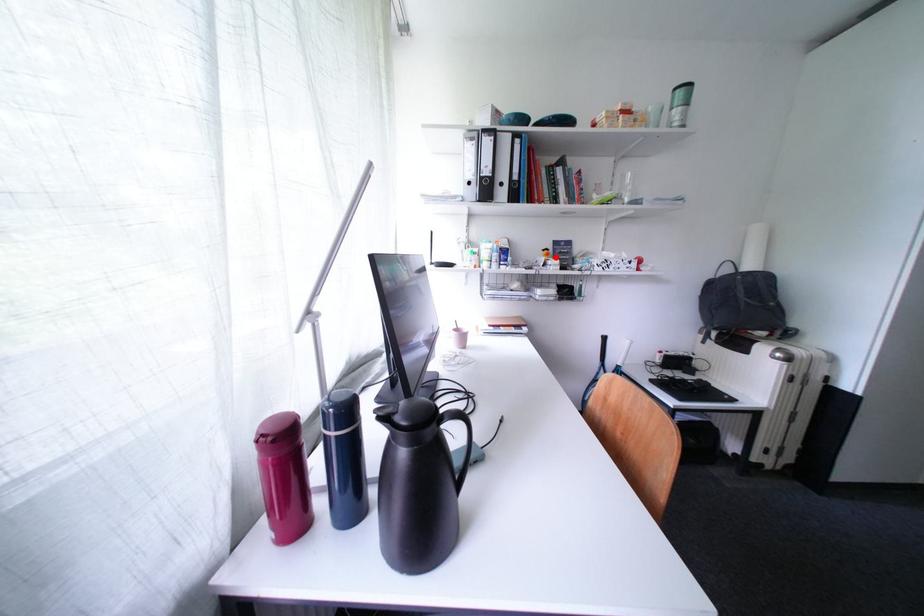
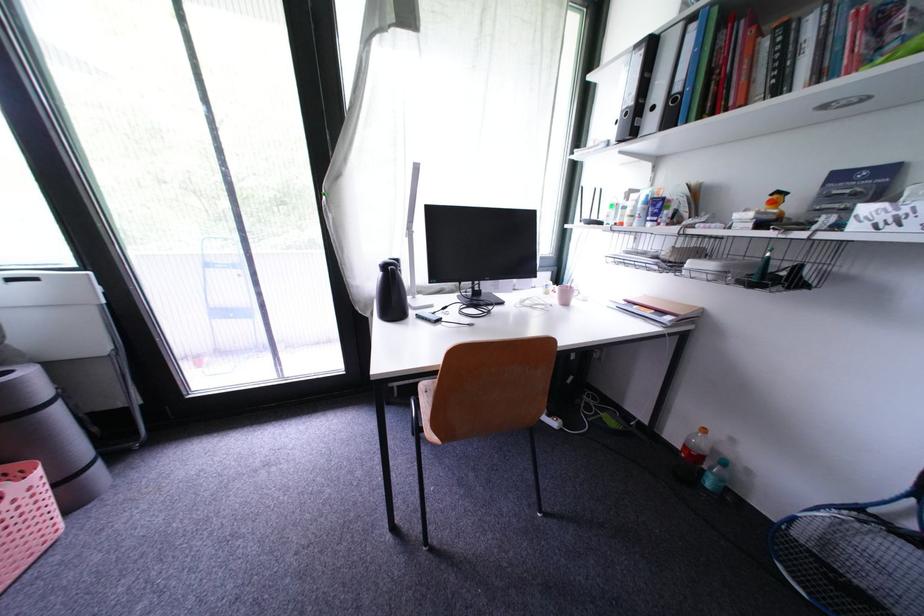
The point at the highlighted location is marked in the first image. Where is the corresponding point in the second image?

(782, 206)